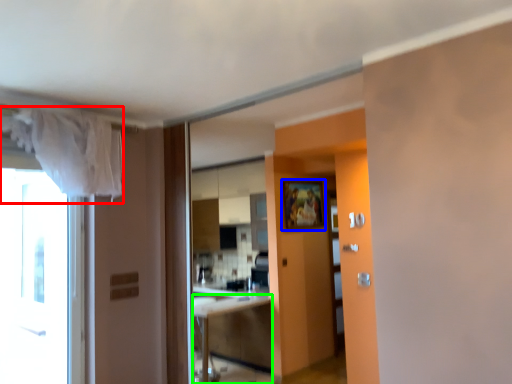
Question: Which object is positioned farthest from curtain (highlighted by a red box)? Select from picture frame (highlighted by a blue box) and cabinetry (highlighted by a green box).

Choices:
 (A) picture frame
 (B) cabinetry

Answer: (B)